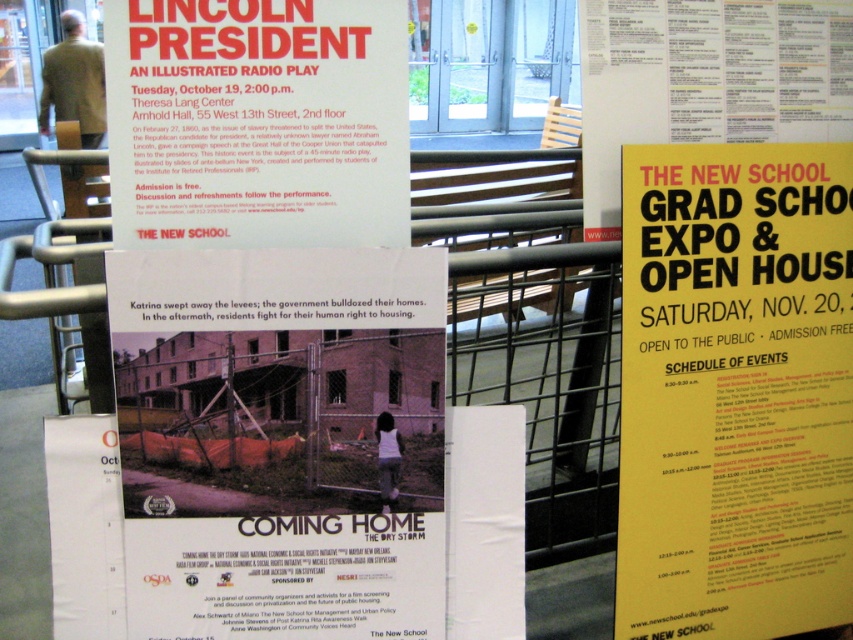
You are organizing a community event and need to ensure that both the yellow paper at upper right and the matte red poster at upper left are visible to attendees. Based on their current positions, which one is positioned lower on the display board?

The yellow paper at upper right is located below the matte red poster at upper left, so it is positioned lower on the display board.

Looking at this image, you are standing in front of the Lincoln President poster. There is a yellow paper marked at point (735, 390). Is the yellow paper located to the left or right of the poster?

The yellow paper marked at point (735, 390) is located to the right of the Lincoln President poster.